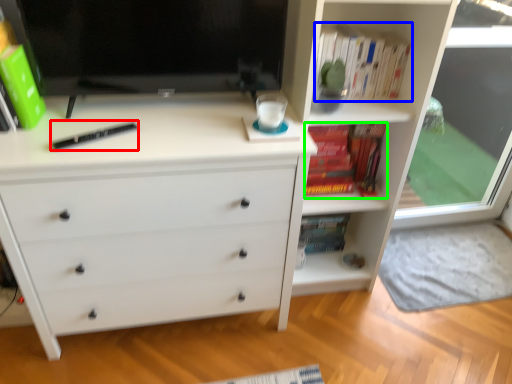
Question: Which is farther away from hardback book (highlighted by a red box)? book (highlighted by a blue box) or book (highlighted by a green box)?

Choices:
 (A) book
 (B) book

Answer: (B)